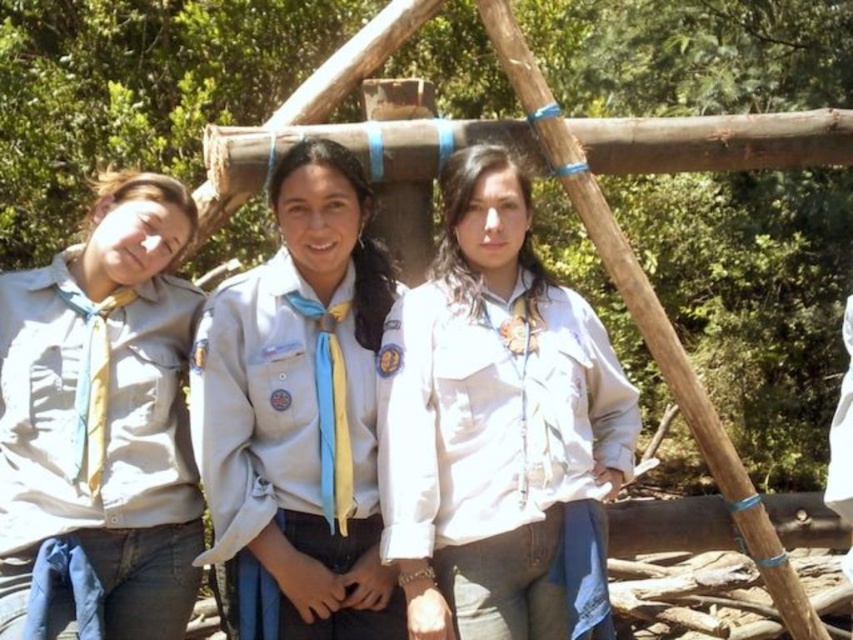
Question: Which object appears closest to the camera in this image?

Choices:
 (A) matte khaki shirt at left
 (B) white matte shirt at center

Answer: (A)

Question: Can you confirm if matte khaki shirt at left is positioned below light blue fabric uniform at center?

Choices:
 (A) no
 (B) yes

Answer: (A)

Question: Among these objects, which one is nearest to the camera?

Choices:
 (A) matte khaki shirt at left
 (B) white matte shirt at center
 (C) light blue fabric uniform at center

Answer: (A)

Question: Which point appears closest to the camera in this image?

Choices:
 (A) (419, 552)
 (B) (106, 392)

Answer: (A)

Question: From the image, what is the correct spatial relationship of white matte shirt at center in relation to matte khaki shirt at left?

Choices:
 (A) left
 (B) right

Answer: (B)

Question: Can you confirm if white matte shirt at center is bigger than light blue fabric uniform at center?

Choices:
 (A) no
 (B) yes

Answer: (B)